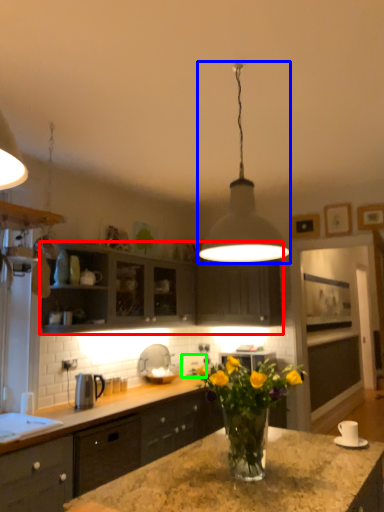
Question: Which object is positioned closest to cabinetry (highlighted by a red box)? Select from lamp (highlighted by a blue box) and appliance (highlighted by a green box).

Choices:
 (A) lamp
 (B) appliance

Answer: (B)